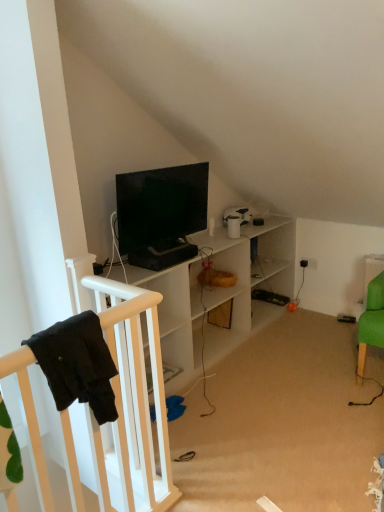
Identify the location of black fabric infant bed at left. (122, 406).

The width and height of the screenshot is (384, 512). What do you see at coordinates (122, 406) in the screenshot?
I see `black fabric infant bed at left` at bounding box center [122, 406].

Describe the element at coordinates (161, 214) in the screenshot. I see `matte black tv at center` at that location.

In order to face matte black tv at center, should I rotate leftwards or rightwards?

It's best to rotate left around 3.516 degrees.

Identify the location of matte black tv at center. The width and height of the screenshot is (384, 512). (161, 214).

Based on the photo, what is the approximate width of matte black tv at center?

It is 21.43 centimeters.

Find the location of a particular element. Image resolution: width=384 pixels, height=512 pixels. black fabric infant bed at left is located at coordinates (122, 406).

Considering the positions of objects matte black tv at center and black fabric infant bed at left in the image provided, who is more to the right, matte black tv at center or black fabric infant bed at left?

matte black tv at center is more to the right.

Is the depth of matte black tv at center less than that of black fabric infant bed at left?

No, it is not.

Does point (122, 216) appear closer or farther from the camera than point (170, 497)?

Point (122, 216).

Consider the image. From the image's perspective, would you say matte black tv at center is shown under black fabric infant bed at left?

No, from the image's perspective, matte black tv at center is not below black fabric infant bed at left.

From a real-world perspective, between matte black tv at center and black fabric infant bed at left, who is vertically lower?

black fabric infant bed at left, from a real-world perspective.

Consider the image. Considering the relative sizes of matte black tv at center and black fabric infant bed at left in the image provided, is matte black tv at center wider than black fabric infant bed at left?

Incorrect, the width of matte black tv at center does not surpass that of black fabric infant bed at left.

Between matte black tv at center and black fabric infant bed at left, which one has more height?

matte black tv at center.

Which of these two, matte black tv at center or black fabric infant bed at left, is smaller?

black fabric infant bed at left.

Is matte black tv at center not inside black fabric infant bed at left?

Yes.

Are matte black tv at center and black fabric infant bed at left making contact?

No, matte black tv at center is not beside black fabric infant bed at left.

Is matte black tv at center facing towards black fabric infant bed at left?

No, matte black tv at center does not turn towards black fabric infant bed at left.

What's the angular difference between matte black tv at center and black fabric infant bed at left's facing directions?

The angle between the facing direction of matte black tv at center and the facing direction of black fabric infant bed at left is 3.28 degrees.

At what (x,y) coordinates should I click in order to perform the action: click on infant bed lying in front of the matte black tv at center. Please return your answer as a coordinate pair (x, y). Looking at the image, I should click on (122, 406).

Is black fabric infant bed at left to the right of matte black tv at center from the viewer's perspective?

Incorrect, black fabric infant bed at left is not on the right side of matte black tv at center.

In the image, is black fabric infant bed at left positioned in front of or behind matte black tv at center?

In the image, black fabric infant bed at left appears in front of matte black tv at center.

Is point (124, 493) more distant than point (134, 191)?

No, (124, 493) is in front of (134, 191).

From the picture: From the image's perspective, which is above, black fabric infant bed at left or matte black tv at center?

matte black tv at center, from the image's perspective.

From a real-world perspective, does black fabric infant bed at left stand above matte black tv at center?

No, from a real-world perspective, black fabric infant bed at left is not above matte black tv at center.

Considering the relative sizes of black fabric infant bed at left and matte black tv at center in the image provided, is black fabric infant bed at left thinner than matte black tv at center?

No, black fabric infant bed at left is not thinner than matte black tv at center.

Which of these two, black fabric infant bed at left or matte black tv at center, stands shorter?

black fabric infant bed at left is shorter.

Who is smaller, black fabric infant bed at left or matte black tv at center?

black fabric infant bed at left.

Is black fabric infant bed at left situated inside matte black tv at center or outside?

black fabric infant bed at left is not enclosed by matte black tv at center.

Based on the photo, is black fabric infant bed at left positioned far away from matte black tv at center?

No, black fabric infant bed at left is not far away from matte black tv at center.

Is black fabric infant bed at left turned away from matte black tv at center?

No.

Consider the image. What's the angular difference between black fabric infant bed at left and matte black tv at center's facing directions?

The angular difference between black fabric infant bed at left and matte black tv at center is 3.28 degrees.

How far apart are black fabric infant bed at left and matte black tv at center?

They are 31.73 inches apart.

I want to click on infant bed below the matte black tv at center (from the image's perspective), so click(122, 406).

You are a GUI agent. You are given a task and a screenshot of the screen. Output one action in this format:
    pyautogui.click(x=<x>, y=<y>)
    Task: Click on the infant bed on the left of the matte black tv at center
    The width and height of the screenshot is (384, 512).
    Given the screenshot: What is the action you would take?
    pyautogui.click(x=122, y=406)

Where is `infant bed that is in front of the matte black tv at center`? This screenshot has width=384, height=512. infant bed that is in front of the matte black tv at center is located at coordinates (122, 406).